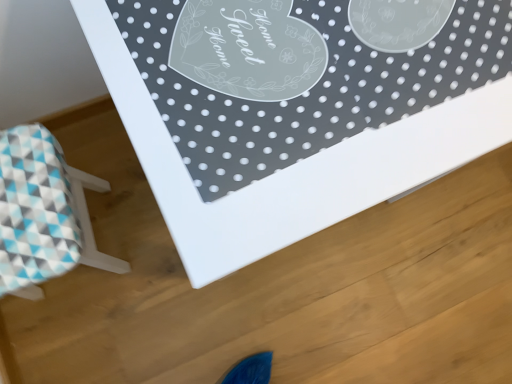
Question: Is blue checkered stool at lower left thinner than white glossy table at upper center?

Choices:
 (A) no
 (B) yes

Answer: (B)

Question: Considering the relative sizes of blue checkered stool at lower left and white glossy table at upper center in the image provided, is blue checkered stool at lower left shorter than white glossy table at upper center?

Choices:
 (A) yes
 (B) no

Answer: (A)

Question: Does blue checkered stool at lower left come behind white glossy table at upper center?

Choices:
 (A) yes
 (B) no

Answer: (A)

Question: Can you confirm if blue checkered stool at lower left is bigger than white glossy table at upper center?

Choices:
 (A) yes
 (B) no

Answer: (B)

Question: Does blue checkered stool at lower left appear on the left side of white glossy table at upper center?

Choices:
 (A) yes
 (B) no

Answer: (A)

Question: From the image's perspective, is blue checkered stool at lower left over white glossy table at upper center?

Choices:
 (A) no
 (B) yes

Answer: (A)

Question: Considering the relative positions of white glossy table at upper center and blue checkered stool at lower left in the image provided, is white glossy table at upper center to the left of blue checkered stool at lower left from the viewer's perspective?

Choices:
 (A) yes
 (B) no

Answer: (B)

Question: Is white glossy table at upper center smaller than blue checkered stool at lower left?

Choices:
 (A) no
 (B) yes

Answer: (A)

Question: Is blue checkered stool at lower left completely or partially inside white glossy table at upper center?

Choices:
 (A) no
 (B) yes

Answer: (A)

Question: Is white glossy table at upper center looking in the opposite direction of blue checkered stool at lower left?

Choices:
 (A) no
 (B) yes

Answer: (A)

Question: Is white glossy table at upper center further to the viewer compared to blue checkered stool at lower left?

Choices:
 (A) no
 (B) yes

Answer: (A)

Question: Considering the relative sizes of white glossy table at upper center and blue checkered stool at lower left in the image provided, is white glossy table at upper center wider than blue checkered stool at lower left?

Choices:
 (A) yes
 (B) no

Answer: (A)

Question: Considering their positions, is white glossy table at upper center located in front of or behind blue checkered stool at lower left?

Choices:
 (A) behind
 (B) front

Answer: (B)